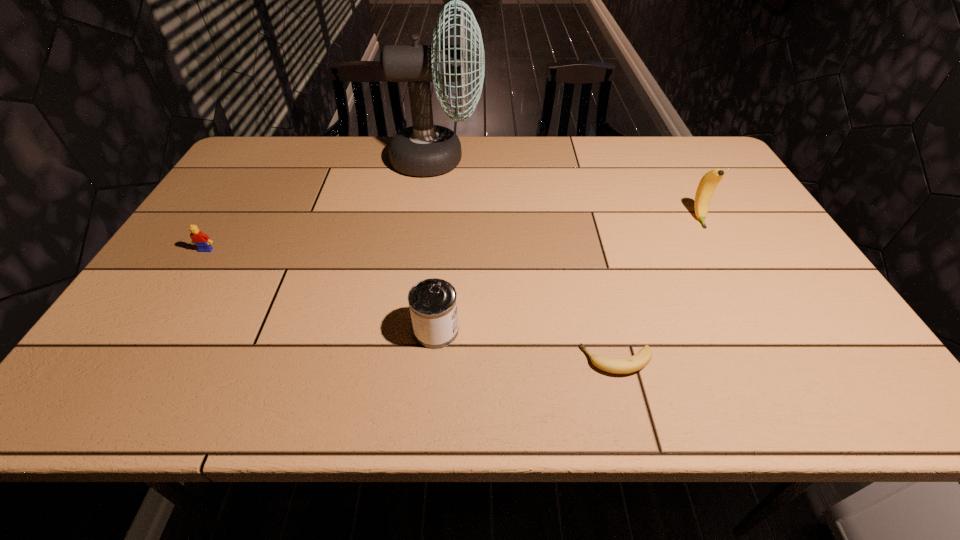
Identify the location of the tallest object. The height and width of the screenshot is (540, 960). (424, 149).

Where is `fan`? Image resolution: width=960 pixels, height=540 pixels. fan is located at coordinates (424, 149).

The width and height of the screenshot is (960, 540). I want to click on the farther banana, so (707, 185).

Where is `the fourth shortest object`? The height and width of the screenshot is (540, 960). the fourth shortest object is located at coordinates (707, 185).

Locate an element on the screen. the third shortest object is located at coordinates (432, 302).

I want to click on Lego, so click(202, 241).

Identify the location of the leftmost object. This screenshot has height=540, width=960. (202, 241).

The image size is (960, 540). I want to click on the shortest object, so click(638, 361).

Locate an element on the screen. The width and height of the screenshot is (960, 540). the shorter banana is located at coordinates (638, 361).

Find the location of a particular element. free space located in front of the fan where the airflow is directed is located at coordinates 502,159.